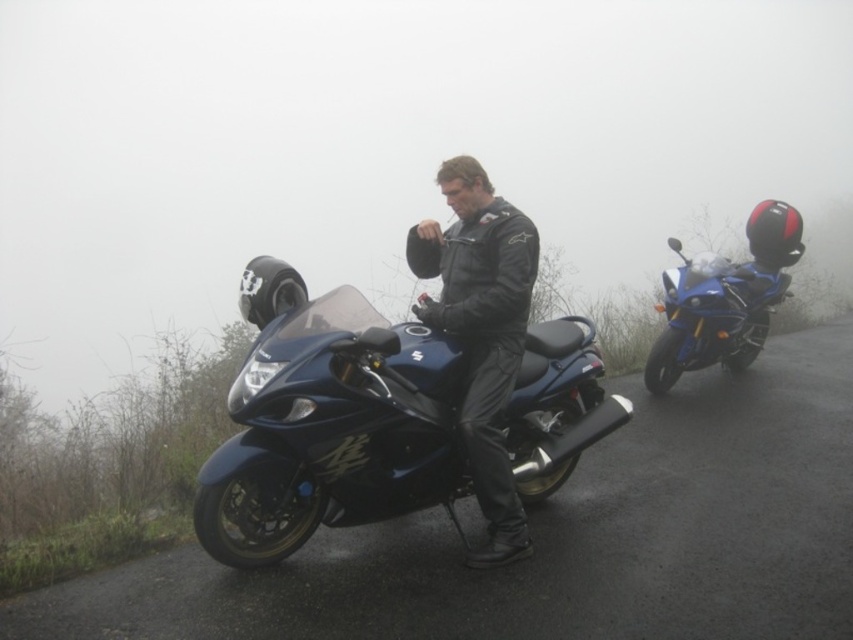
Between glossy black motorcycle at center and glossy blue motorcycle at right, which one is positioned higher?

Positioned higher is glossy blue motorcycle at right.

Can you confirm if glossy black motorcycle at center is thinner than glossy blue motorcycle at right?

No, glossy black motorcycle at center is not thinner than glossy blue motorcycle at right.

You are a GUI agent. You are given a task and a screenshot of the screen. Output one action in this format:
    pyautogui.click(x=<x>, y=<y>)
    Task: Click on the glossy black motorcycle at center
    The width and height of the screenshot is (853, 640).
    Given the screenshot: What is the action you would take?
    (x=329, y=422)

Can you confirm if glossy asphalt road at center is wider than glossy black motorcycle at center?

No, glossy asphalt road at center is not wider than glossy black motorcycle at center.

Which is above, glossy asphalt road at center or glossy black motorcycle at center?

glossy black motorcycle at center is higher up.

Identify the location of glossy asphalt road at center. The width and height of the screenshot is (853, 640). (561, 538).

In order to click on glossy asphalt road at center in this screenshot , I will do `click(561, 538)`.

Which is more to the left, black leather jacket at center or glossy blue motorcycle at right?

Positioned to the left is black leather jacket at center.

Can you confirm if black leather jacket at center is positioned to the left of glossy blue motorcycle at right?

Correct, you'll find black leather jacket at center to the left of glossy blue motorcycle at right.

Is point (517, 524) positioned after point (706, 337)?

No, (517, 524) is in front of (706, 337).

Locate an element on the screen. Image resolution: width=853 pixels, height=640 pixels. black leather jacket at center is located at coordinates (480, 330).